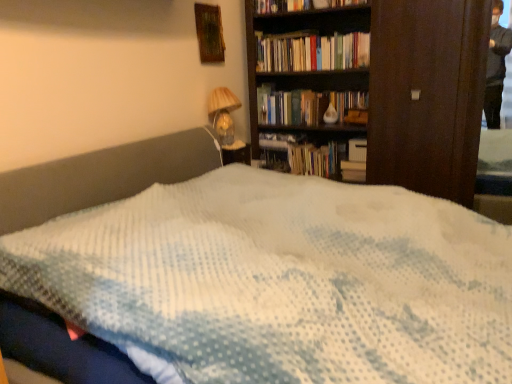
The image size is (512, 384). Find the location of `free space above hardcover books at upper center (from a real-world perspective)`. free space above hardcover books at upper center (from a real-world perspective) is located at coordinates (322, 33).